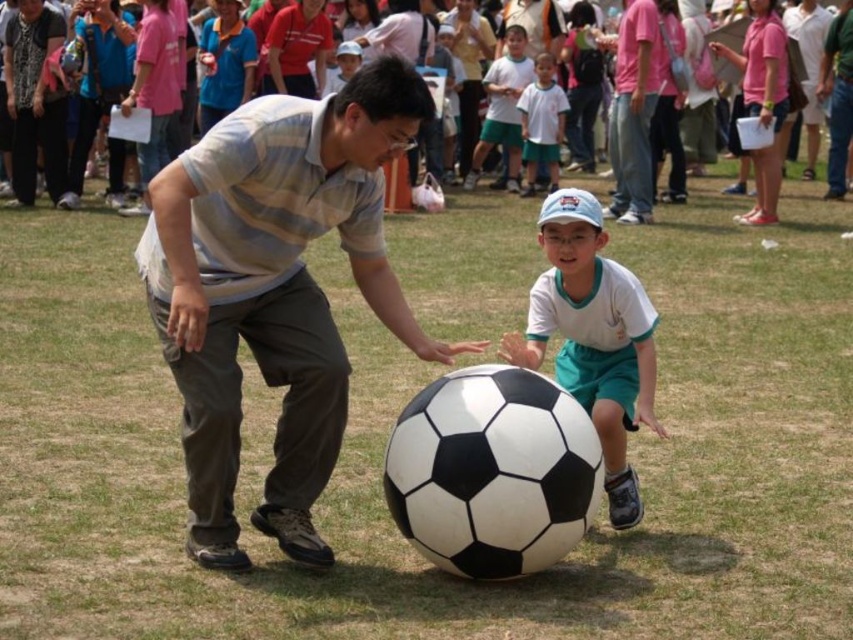
Question: Which point is farther to the camera?

Choices:
 (A) (194, 515)
 (B) (505, 92)

Answer: (B)

Question: Does white matte soccer ball at center appear on the left side of white matte shirt at upper center?

Choices:
 (A) no
 (B) yes

Answer: (B)

Question: Considering the real-world distances, which object is closest to the white matte soccer ball at center?

Choices:
 (A) white matte shirt at upper center
 (B) pink cotton crowd at upper center

Answer: (B)

Question: Does white matte shirt at upper center have a lesser width compared to pink cotton crowd at upper center?

Choices:
 (A) yes
 (B) no

Answer: (A)

Question: In this image, where is white matte soccer ball at center located relative to white cotton shirt at upper center?

Choices:
 (A) above
 (B) below

Answer: (B)

Question: Which point is farther to the camera?

Choices:
 (A) striped cotton shirt at center
 (B) pink cotton crowd at upper center
 (C) white matte soccer ball at center
 (D) white cotton shirt at upper center

Answer: (D)